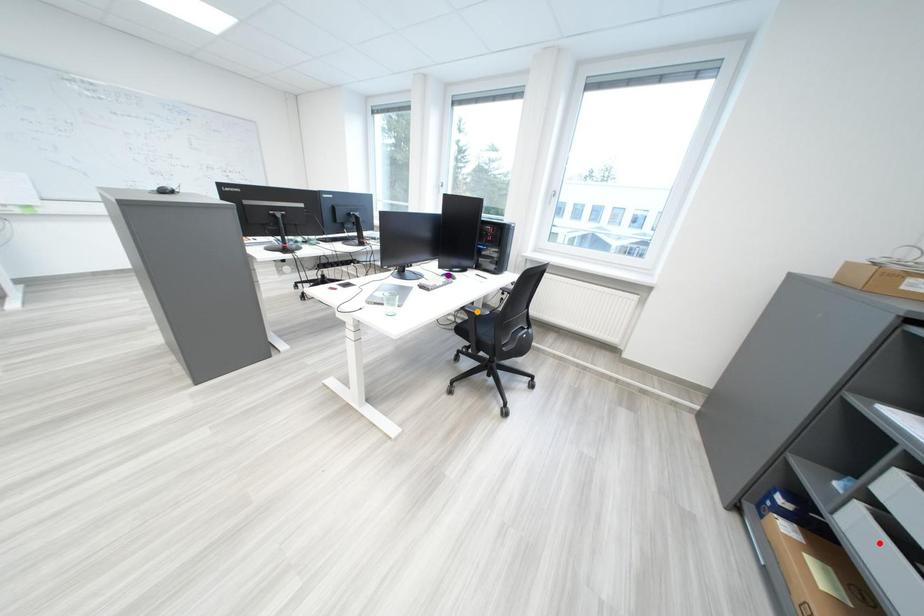
Order these from nearest to farthest:
1. orange point
2. red point
3. purple point

red point
orange point
purple point